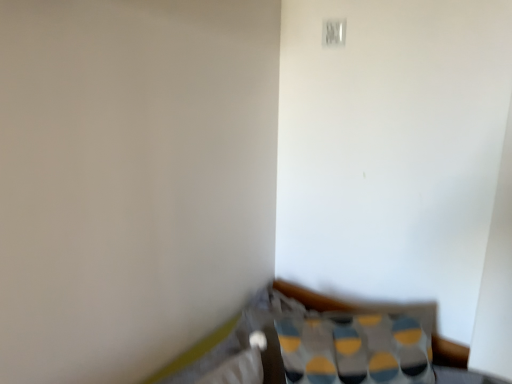
The image size is (512, 384). I want to click on patterned fabric cushion at lower right, so click(317, 346).

The height and width of the screenshot is (384, 512). What do you see at coordinates (317, 346) in the screenshot?
I see `patterned fabric cushion at lower right` at bounding box center [317, 346].

The height and width of the screenshot is (384, 512). What are the coordinates of `patterned fabric cushion at lower right` in the screenshot? It's located at (317, 346).